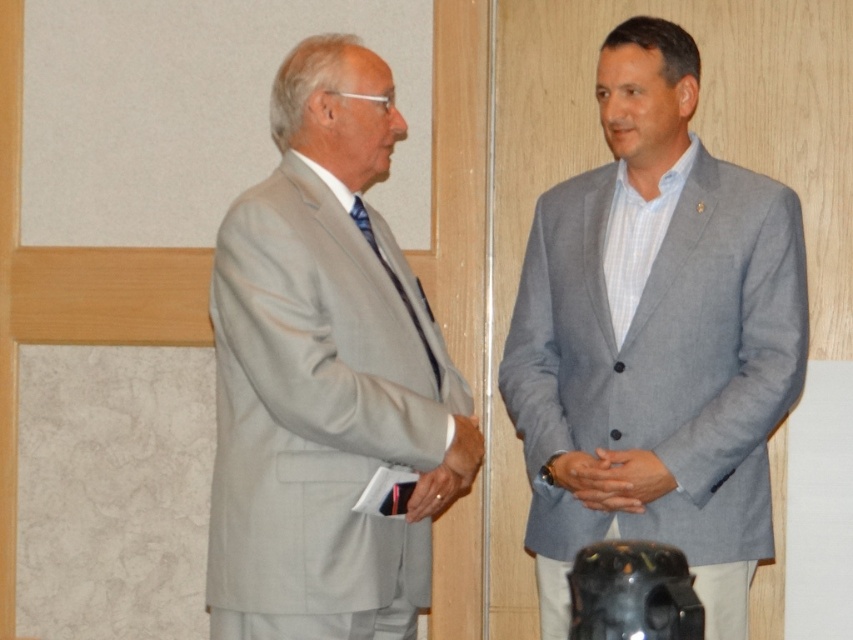
Question: Does gray fabric suit at right appear on the right side of smooth gray hands at center?

Choices:
 (A) no
 (B) yes

Answer: (B)

Question: Which point is farther from the camera taking this photo?

Choices:
 (A) (605, 60)
 (B) (364, 164)

Answer: (A)

Question: Can you confirm if gray fabric suit at right is wider than gray matte suit at left?

Choices:
 (A) yes
 (B) no

Answer: (A)

Question: Which object is closer to the camera taking this photo?

Choices:
 (A) gray fabric suit at right
 (B) gray matte suit at left
 (C) smooth gray hands at center

Answer: (B)

Question: Is gray fabric suit at right further to camera compared to smooth gray hands at center?

Choices:
 (A) no
 (B) yes

Answer: (A)

Question: Which object is the closest to the gray fabric suit at right?

Choices:
 (A) smooth gray hands at center
 (B) gray matte suit at left

Answer: (A)